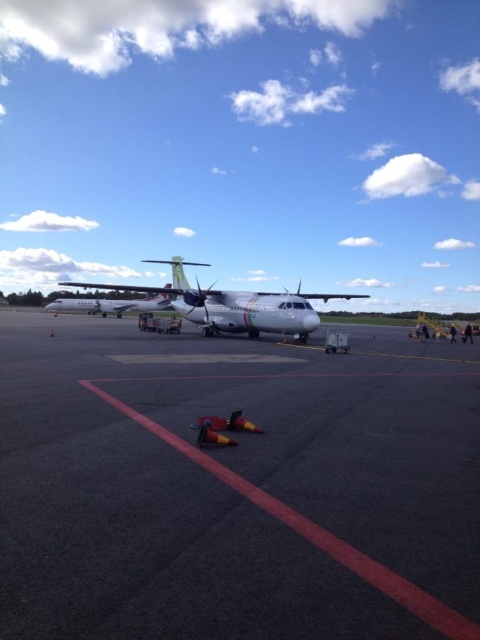
Question: Which of the following is the closest to the observer?

Choices:
 (A) (290, 317)
 (B) (81, 301)

Answer: (A)

Question: Which object appears closest to the camera in this image?

Choices:
 (A) white matte airplane at center
 (B) white glossy airplane at center
 (C) black asphalt tarmac at center

Answer: (C)

Question: Considering the relative positions of black asphalt tarmac at center and white matte airplane at center in the image provided, where is black asphalt tarmac at center located with respect to white matte airplane at center?

Choices:
 (A) right
 (B) left

Answer: (A)

Question: Can you confirm if black asphalt tarmac at center is bigger than white glossy airplane at center?

Choices:
 (A) yes
 (B) no

Answer: (B)

Question: Which is farther from the white matte airplane at center?

Choices:
 (A) black asphalt tarmac at center
 (B) white glossy airplane at center

Answer: (A)

Question: Is black asphalt tarmac at center to the right of white matte airplane at center from the viewer's perspective?

Choices:
 (A) yes
 (B) no

Answer: (A)